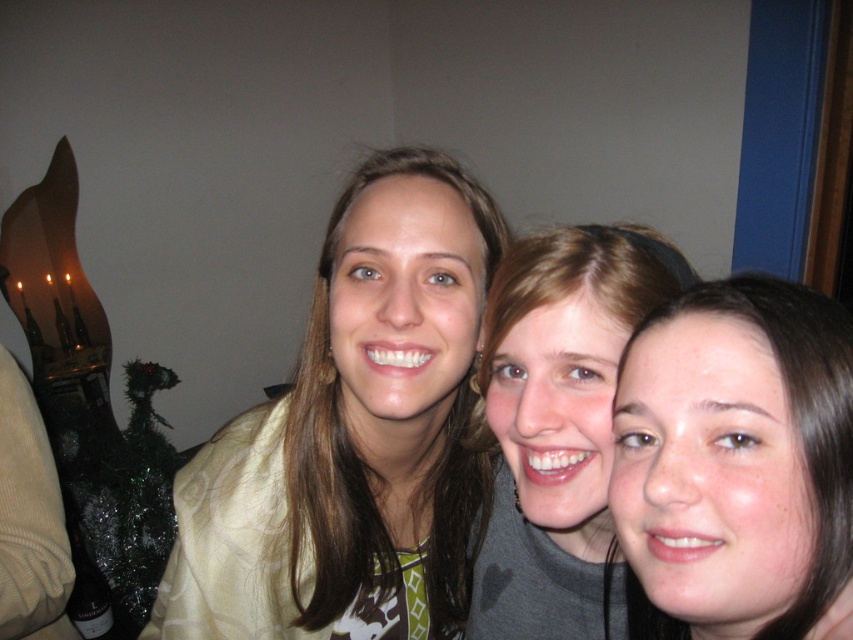
Which of these two, light beige sweater at center or gray matte shirt at center, stands taller?

light beige sweater at center

Is light beige sweater at center thinner than gray matte shirt at center?

Incorrect, light beige sweater at center's width is not less than gray matte shirt at center's.

Where is `light beige sweater at center`? This screenshot has width=853, height=640. light beige sweater at center is located at coordinates (352, 435).

Locate an element on the screen. light beige sweater at center is located at coordinates (352, 435).

Between dark brown hair at center and gray matte shirt at center, which one appears on the left side from the viewer's perspective?

gray matte shirt at center is more to the left.

Measure the distance between point (780,630) and camera.

The distance of point (780,630) from camera is 43.05 centimeters.

Where is `dark brown hair at center`? dark brown hair at center is located at coordinates (734, 461).

Which is above, light beige sweater at center or dark brown hair at center?

dark brown hair at center is above.

Does point (433, 180) lie in front of point (735, 595)?

That is False.

Which is in front, point (380, 400) or point (743, 362)?

Point (743, 362) is in front.

Image resolution: width=853 pixels, height=640 pixels. I want to click on light beige sweater at center, so click(x=352, y=435).